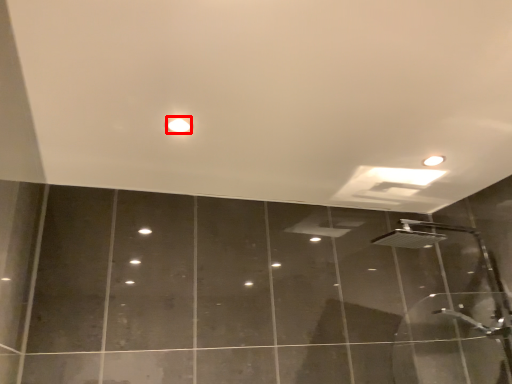
Question: From the image's perspective, where is droplight (annotated by the red box) located in relation to shower in the image?

Choices:
 (A) below
 (B) above

Answer: (B)